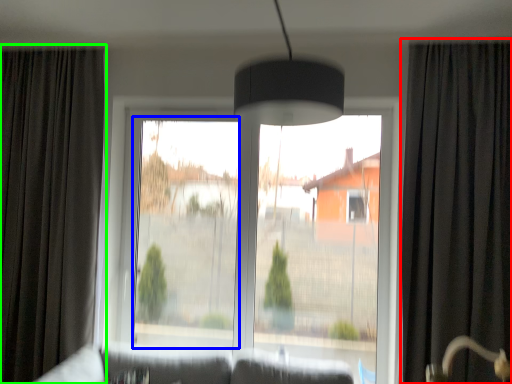
Question: Estimate the real-world distances between objects in this image. Which object is farther from curtain (highlighted by a red box), window screen (highlighted by a blue box) or curtain (highlighted by a green box)?

Choices:
 (A) window screen
 (B) curtain

Answer: (B)